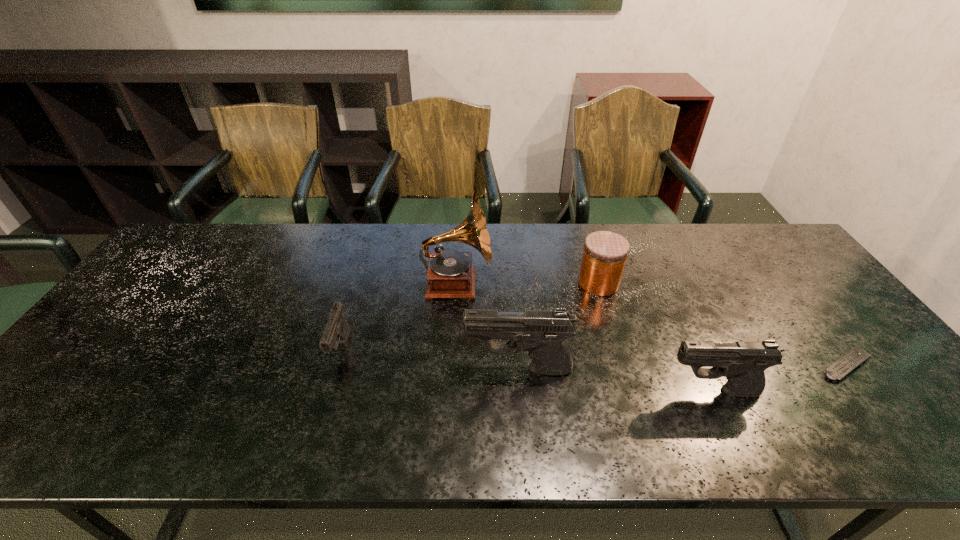
Identify the location of vacant area between the third object from right to left and the tallest object. (528, 283).

Identify the location of free space between the nearest pistol and the second pistol from right to left. This screenshot has width=960, height=540. (615, 380).

Image resolution: width=960 pixels, height=540 pixels. In order to click on unoccupied position between the shortest object and the second pistol from right to left in this screenshot , I will do `click(682, 367)`.

Where is `free space between the leftmost pistol and the shortest object`? This screenshot has height=540, width=960. free space between the leftmost pistol and the shortest object is located at coordinates (593, 357).

Find the location of a particular element. Image resolution: width=960 pixels, height=540 pixels. free space between the jar and the remote control is located at coordinates (722, 324).

Where is `vacant area between the nearest pistol and the jar`? This screenshot has height=540, width=960. vacant area between the nearest pistol and the jar is located at coordinates (656, 337).

Choose which object is the nearest neighbor to the nearest object. Please provide its 2D coordinates. Your answer should be formatted as a tuple, i.e. [(x, y)], where the tuple contains the x and y coordinates of a point satisfying the conditions above.

[(843, 366)]

Identify which object is the second closest to the fourth object from left to right. Please provide its 2D coordinates. Your answer should be formatted as a tuple, i.e. [(x, y)], where the tuple contains the x and y coordinates of a point satisfying the conditions above.

[(451, 274)]

Identify which pistol is the closest to the shortest pistol. Please provide its 2D coordinates. Your answer should be formatted as a tuple, i.e. [(x, y)], where the tuple contains the x and y coordinates of a point satisfying the conditions above.

[(542, 333)]

Identify which pistol is located as the nearest to the shortest pistol. Please provide its 2D coordinates. Your answer should be formatted as a tuple, i.e. [(x, y)], where the tuple contains the x and y coordinates of a point satisfying the conditions above.

[(542, 333)]